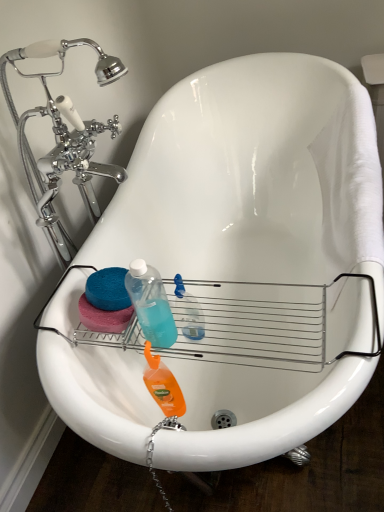
Question: In the image, is translucent plastic bottle at center, marked as the 1th cleaning product in a top-to-bottom arrangement, on the left side or the right side of orange matte liquid at center, which is the first cleaning product from bottom to top?

Choices:
 (A) right
 (B) left

Answer: (A)

Question: From a real-world perspective, relative to orange matte liquid at center, which is the second cleaning product in top-to-bottom order, is translucent plastic bottle at center, marked as the 1th cleaning product in a top-to-bottom arrangement, vertically above or below?

Choices:
 (A) below
 (B) above

Answer: (B)

Question: Considering the positions of point (175, 297) and point (157, 373), is point (175, 297) closer or farther from the camera than point (157, 373)?

Choices:
 (A) farther
 (B) closer

Answer: (A)

Question: From their relative heights in the image, would you say orange matte liquid at center, which is the second cleaning product in top-to-bottom order, is taller or shorter than translucent plastic bottle at center, the 2th cleaning product in the bottom-to-top sequence?

Choices:
 (A) tall
 (B) short

Answer: (A)

Question: From the image's perspective, is orange matte liquid at center, which is the second cleaning product in top-to-bottom order, located above or below translucent plastic bottle at center, the 2th cleaning product in the bottom-to-top sequence?

Choices:
 (A) below
 (B) above

Answer: (A)

Question: Considering the positions of orange matte liquid at center, which is the first cleaning product from bottom to top, and translucent plastic bottle at center, the 2th cleaning product in the bottom-to-top sequence, in the image, is orange matte liquid at center, which is the first cleaning product from bottom to top, bigger or smaller than translucent plastic bottle at center, the 2th cleaning product in the bottom-to-top sequence,?

Choices:
 (A) big
 (B) small

Answer: (A)

Question: In the image, is orange matte liquid at center, which is the second cleaning product in top-to-bottom order, on the left side or the right side of translucent plastic bottle at center, marked as the 1th cleaning product in a top-to-bottom arrangement?

Choices:
 (A) right
 (B) left

Answer: (B)